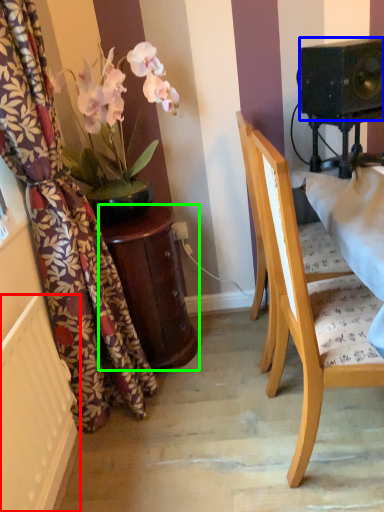
Question: Considering the real-world distances, which object is closest to radiator (highlighted by a red box)? speaker (highlighted by a blue box) or table (highlighted by a green box).

Choices:
 (A) speaker
 (B) table

Answer: (B)